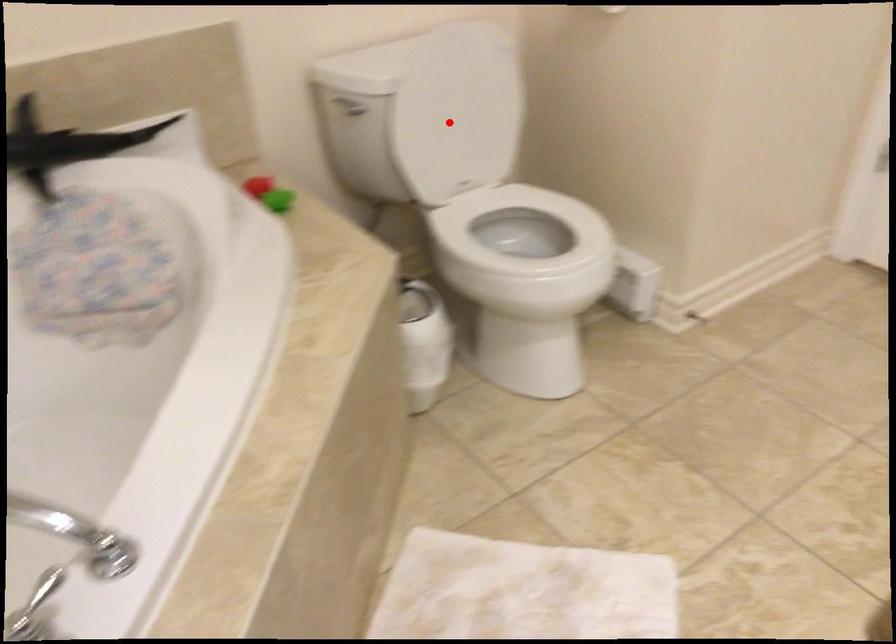
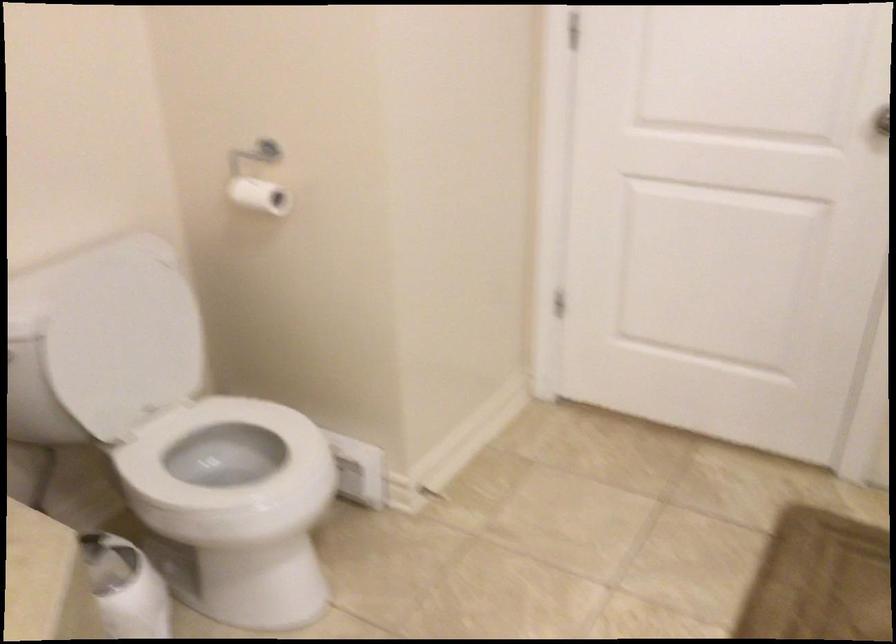
Question: A red point is marked in image1. In image2, is the corresponding 3D point closer to the camera or farther? Reply with the corresponding letter.

Choices:
 (A) The corresponding 3D point is closer.
 (B) The corresponding 3D point is farther.

Answer: (A)